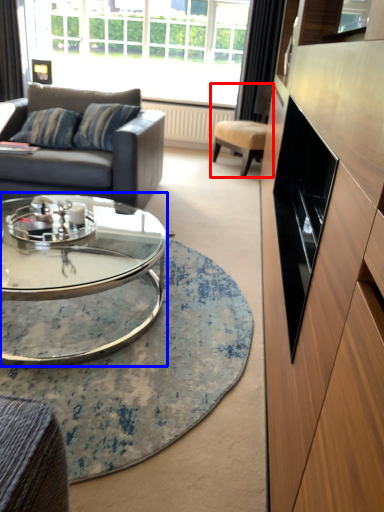
Question: Among these objects, which one is nearest to the camera, chair (highlighted by a red box) or coffee table (highlighted by a blue box)?

Choices:
 (A) chair
 (B) coffee table

Answer: (B)